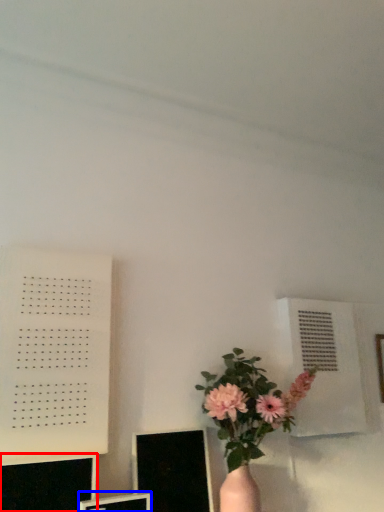
Question: Which object is closer to the camera taking this photo, computer monitor (highlighted by a red box) or computer monitor (highlighted by a blue box)?

Choices:
 (A) computer monitor
 (B) computer monitor

Answer: (A)